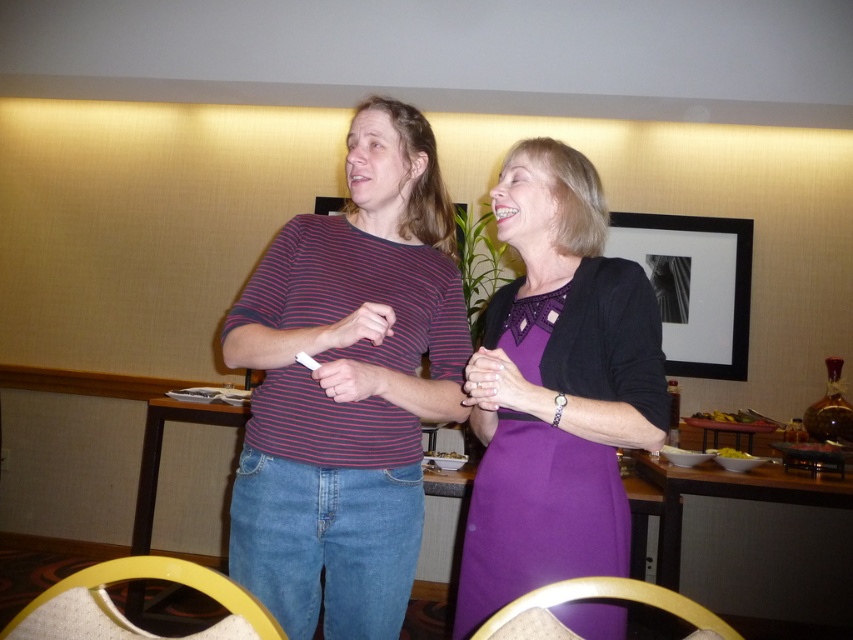
Who is taller, striped cotton shirt at center or purple satin dress at center?

Standing taller between the two is striped cotton shirt at center.

Identify the location of striped cotton shirt at center. (347, 387).

Identify the location of striped cotton shirt at center. This screenshot has width=853, height=640. (347, 387).